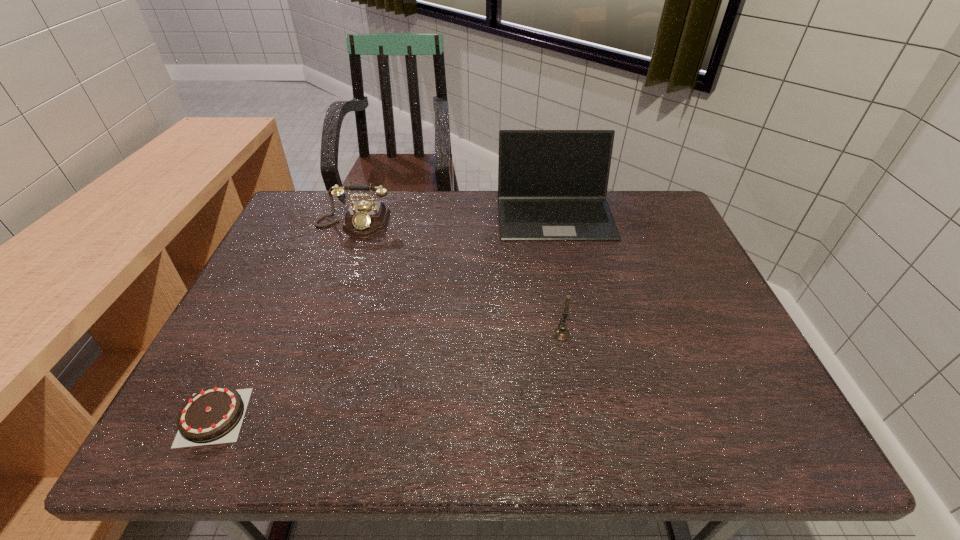
At what (x,y) coordinates should I click in order to perform the action: click on telephone present at the far edge. Please return your answer as a coordinate pair (x, y). Looking at the image, I should click on (364, 219).

Image resolution: width=960 pixels, height=540 pixels. What are the coordinates of `object that is at the near edge` in the screenshot? It's located at (214, 415).

Identify the location of telephone located in the left edge section of the desktop. (364, 219).

Where is `chocolate cake that is at the left edge`? The width and height of the screenshot is (960, 540). chocolate cake that is at the left edge is located at coordinates (214, 415).

What are the coordinates of `object at the far left corner` in the screenshot? It's located at (364, 219).

Where is `object that is positioned at the near left corner`? This screenshot has height=540, width=960. object that is positioned at the near left corner is located at coordinates (214, 415).

What are the coordinates of `vacant space at the far edge` in the screenshot? It's located at (477, 225).

Image resolution: width=960 pixels, height=540 pixels. In order to click on vacant area at the near edge of the desktop in this screenshot , I will do `click(335, 428)`.

Identify the location of blank space at the left edge of the desktop. This screenshot has height=540, width=960. (264, 299).

In order to click on free spot at the right edge of the desktop in this screenshot , I will do `click(733, 363)`.